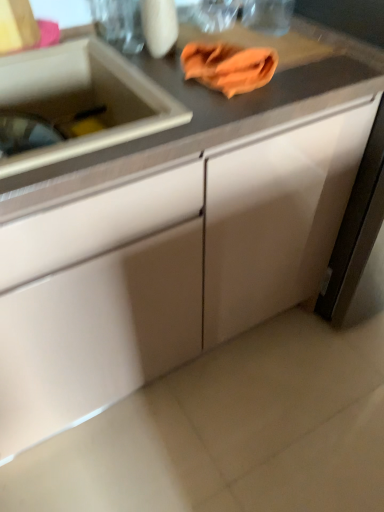
Where is `free space in front of orange cloth at upper center`? free space in front of orange cloth at upper center is located at coordinates (210, 113).